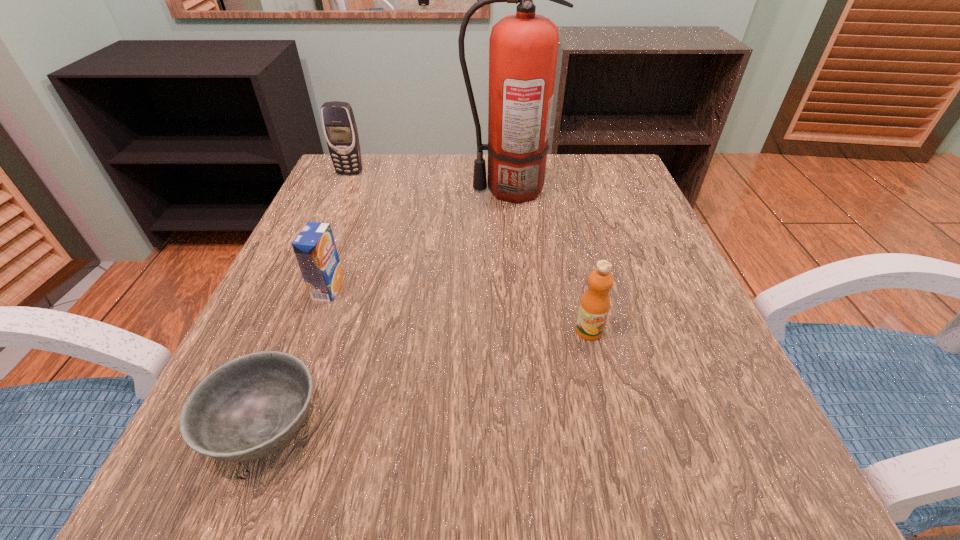
Locate an element on the screen. This screenshot has width=960, height=540. free region located on the nozzle of the tallest object is located at coordinates (398, 190).

You are a GUI agent. You are given a task and a screenshot of the screen. Output one action in this format:
    pyautogui.click(x=<x>, y=<y>)
    Task: Click on the blank area located 0.050m on the front face of the fourth shortest object
    This screenshot has height=540, width=960.
    Given the screenshot: What is the action you would take?
    pyautogui.click(x=344, y=187)

You are a GUI agent. You are given a task and a screenshot of the screen. Output one action in this format:
    pyautogui.click(x=<x>, y=<y>)
    Task: Click on the vacant space situated on the front label of the right orange_juice
    This screenshot has width=960, height=540.
    Given the screenshot: What is the action you would take?
    pyautogui.click(x=607, y=403)

The height and width of the screenshot is (540, 960). I want to click on vacant space positioned 0.390m on the back of the left orange_juice, so tap(372, 172).

Locate an element on the screen. The image size is (960, 540). vacant space located on the right of the bowl is located at coordinates (361, 428).

Find the location of `fire extinguisher at the far edge`. fire extinguisher at the far edge is located at coordinates (523, 47).

Identify the location of cellular telephone present at the far edge. (340, 129).

At what (x,y) coordinates should I click in order to perform the action: click on object located at the near edge. Please return your answer as a coordinate pair (x, y). The image size is (960, 540). Looking at the image, I should click on (249, 407).

This screenshot has width=960, height=540. Identify the location of cellular telephone positioned at the left edge. (340, 129).

Find the location of a particular element. orange_juice located in the left edge section of the desktop is located at coordinates (314, 247).